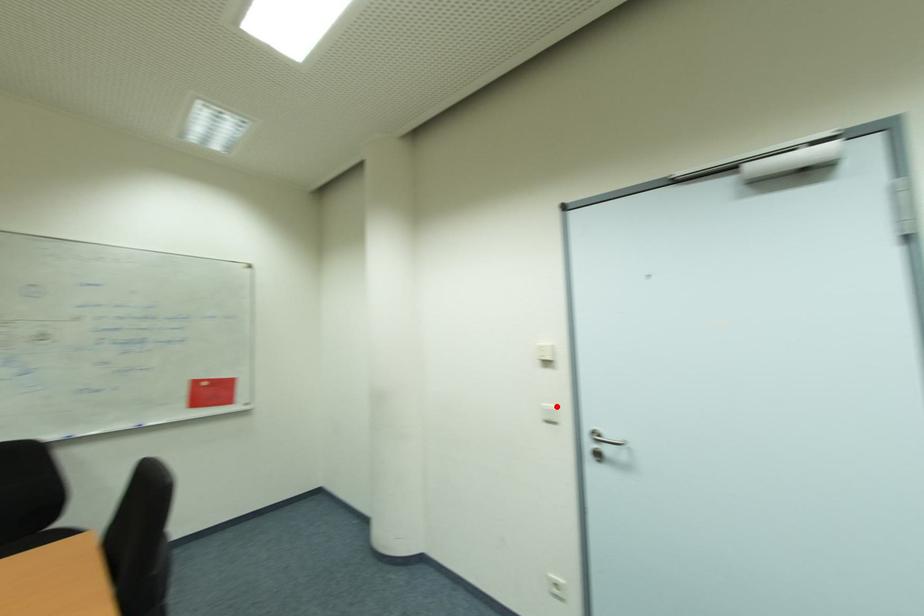
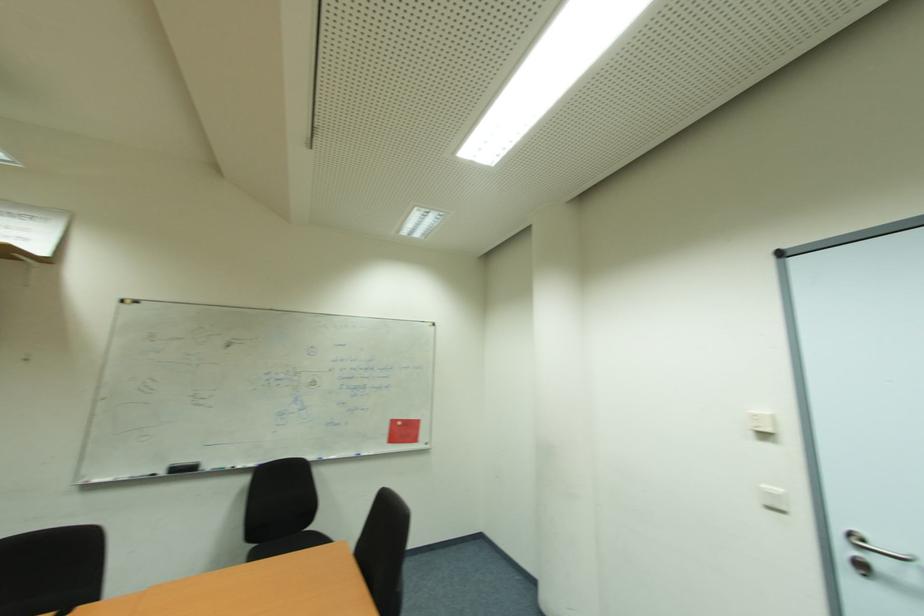
In the second image, find the point that corresponds to the highlighted location in the first image.

(784, 492)